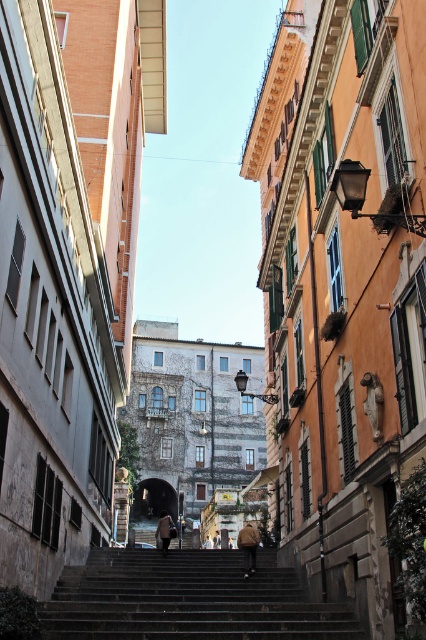
Can you confirm if dark gray concrete stairs at center is thinner than brown leather jacket at center?

In fact, dark gray concrete stairs at center might be wider than brown leather jacket at center.

Can you confirm if dark gray concrete stairs at center is taller than brown leather jacket at center?

Incorrect, dark gray concrete stairs at center's height is not larger of brown leather jacket at center's.

Which is in front, point (109, 561) or point (242, 529)?

Positioned in front is point (109, 561).

Identify the location of dark gray concrete stairs at center. (187, 600).

Where is `brown leather jacket at center`? This screenshot has height=640, width=426. brown leather jacket at center is located at coordinates (249, 547).

Does point (247, 566) come closer to viewer compared to point (207, 538)?

Yes.

Where is `brown leather jacket at center`? brown leather jacket at center is located at coordinates (249, 547).

Does brown leather coat at center have a smaller size compared to light brown leather jacket at center?

No, brown leather coat at center is not smaller than light brown leather jacket at center.

Can you confirm if brown leather coat at center is taller than light brown leather jacket at center?

Correct, brown leather coat at center is much taller as light brown leather jacket at center.

Is point (169, 541) positioned in front of point (204, 544)?

Yes, it is.

Locate an element on the screen. Image resolution: width=426 pixels, height=640 pixels. brown leather coat at center is located at coordinates (164, 529).